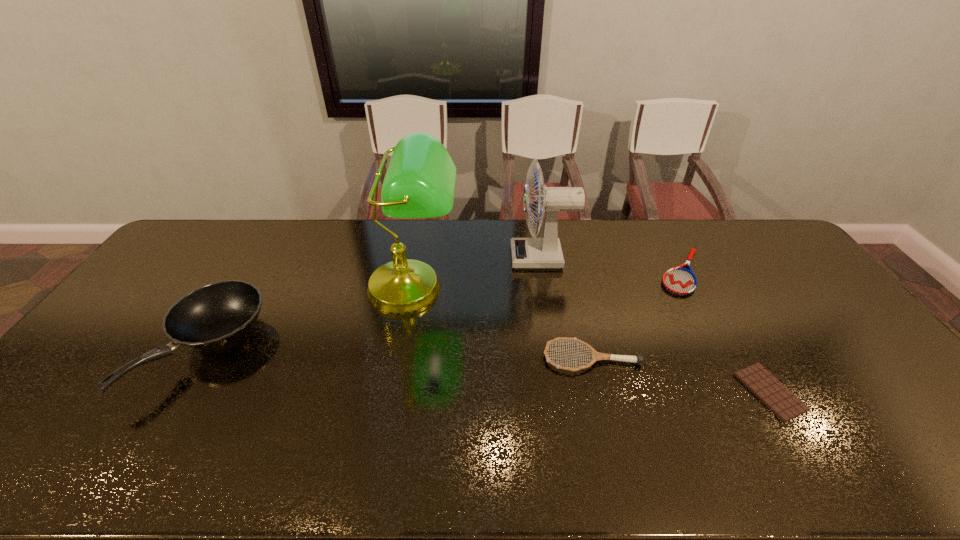
The width and height of the screenshot is (960, 540). In order to click on tennis racket that is positioned at the far edge in this screenshot , I will do `click(678, 280)`.

Image resolution: width=960 pixels, height=540 pixels. I want to click on vacant area at the far edge of the desktop, so click(423, 231).

In the image, there is a desktop. Find the location of `free space at the near edge`. free space at the near edge is located at coordinates (179, 475).

Locate an element on the screen. free location at the left edge is located at coordinates (154, 301).

Where is `vacant space at the right edge of the desktop`? Image resolution: width=960 pixels, height=540 pixels. vacant space at the right edge of the desktop is located at coordinates (793, 287).

Identify the location of vacant space at the far left corner of the desktop. (181, 241).

What are the coordinates of `free spot between the frying pan and the nearer tennis racket` in the screenshot? It's located at (399, 354).

Locate an element on the screen. free space between the right tennis racket and the fan is located at coordinates (612, 265).

The width and height of the screenshot is (960, 540). What are the coordinates of `vacant space that's between the fan and the lamp` in the screenshot? It's located at (477, 273).

Find the location of a particular element. This screenshot has height=540, width=960. vacant space in between the fifth object from right to left and the shortest object is located at coordinates pos(591,340).